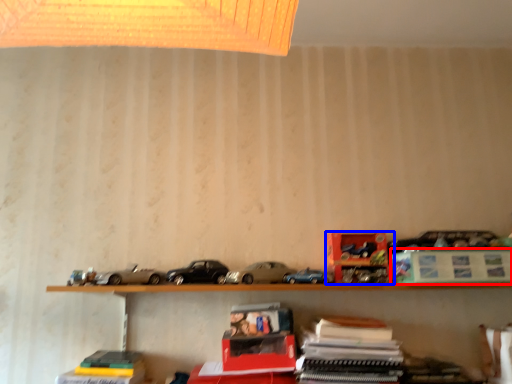
Question: Among these objects, which one is farthest to the camera, paperback book (highlighted by a red box) or toy (highlighted by a blue box)?

Choices:
 (A) paperback book
 (B) toy

Answer: (B)